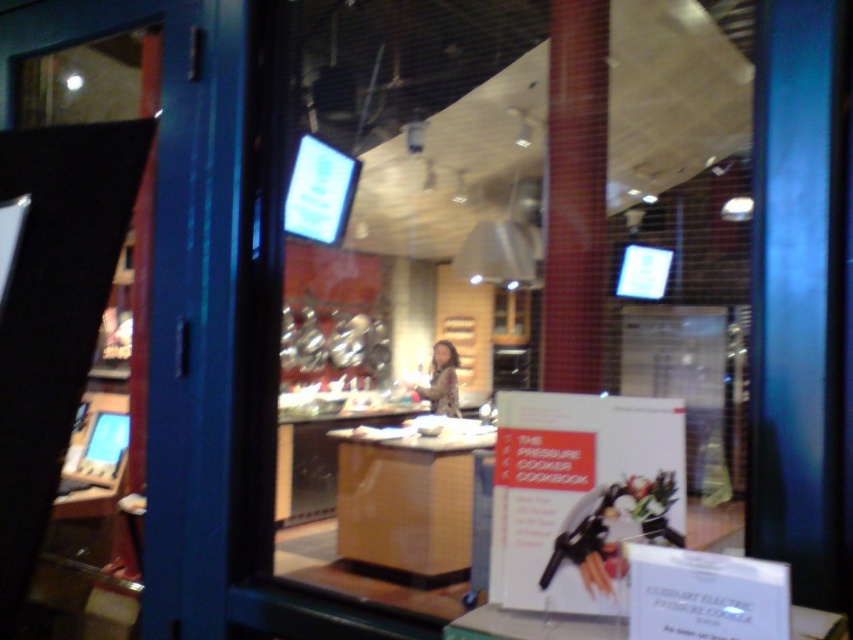
Question: Can you confirm if white cardboard at center is positioned below transparent glass door at left?

Choices:
 (A) no
 (B) yes

Answer: (B)

Question: Does white cardboard at center have a smaller size compared to transparent glass door at left?

Choices:
 (A) yes
 (B) no

Answer: (A)

Question: Which point is farther from the camera taking this photo?

Choices:
 (A) (192, 371)
 (B) (640, 54)

Answer: (A)

Question: Can you confirm if white cardboard at center is smaller than transparent glass door at left?

Choices:
 (A) no
 (B) yes

Answer: (B)

Question: Which of the following is the closest to the observer?

Choices:
 (A) transparent glass door at left
 (B) white cardboard at center

Answer: (B)